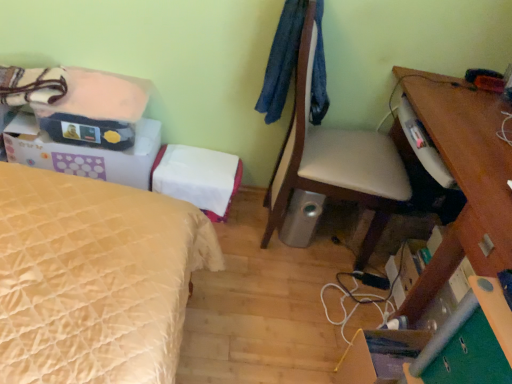
Locate an element on the screen. The width and height of the screenshot is (512, 384). vacant space situated above white fabric storage box at center, the 2th storage box when ordered from right to left (from a real-world perspective) is located at coordinates (199, 165).